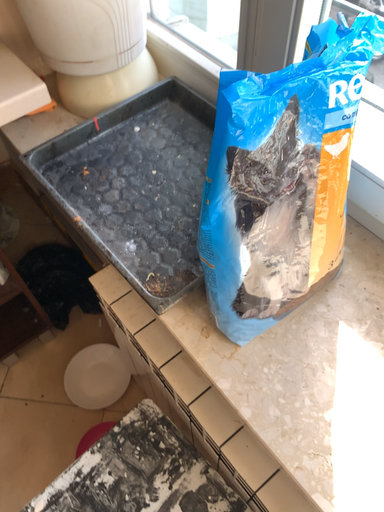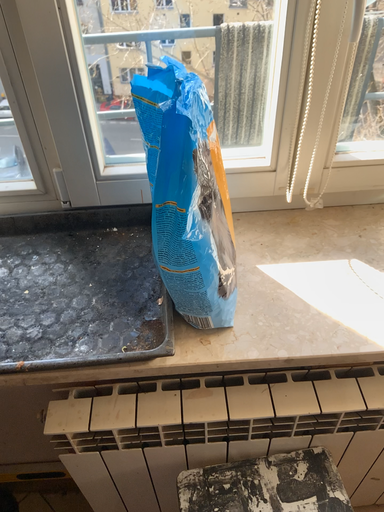
Question: How did the camera likely rotate when shooting the video?

Choices:
 (A) rotated upward
 (B) rotated downward

Answer: (A)